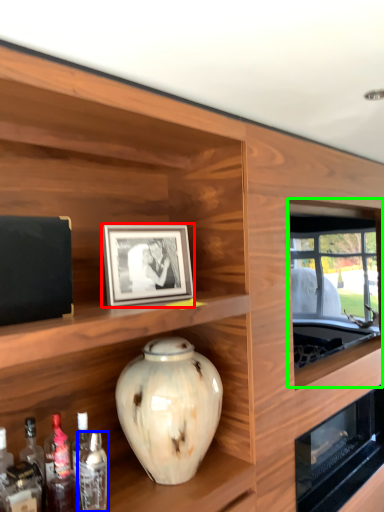
Question: Estimate the real-world distances between objects in this image. Which object is closer to picture frame (highlighted by a red box), bottle (highlighted by a blue box) or window (highlighted by a green box)?

Choices:
 (A) bottle
 (B) window

Answer: (A)